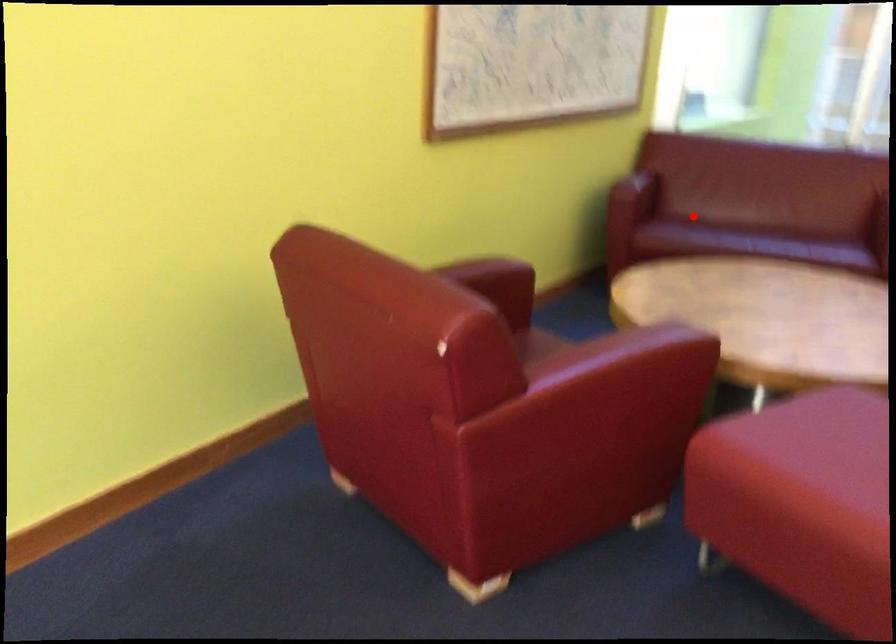
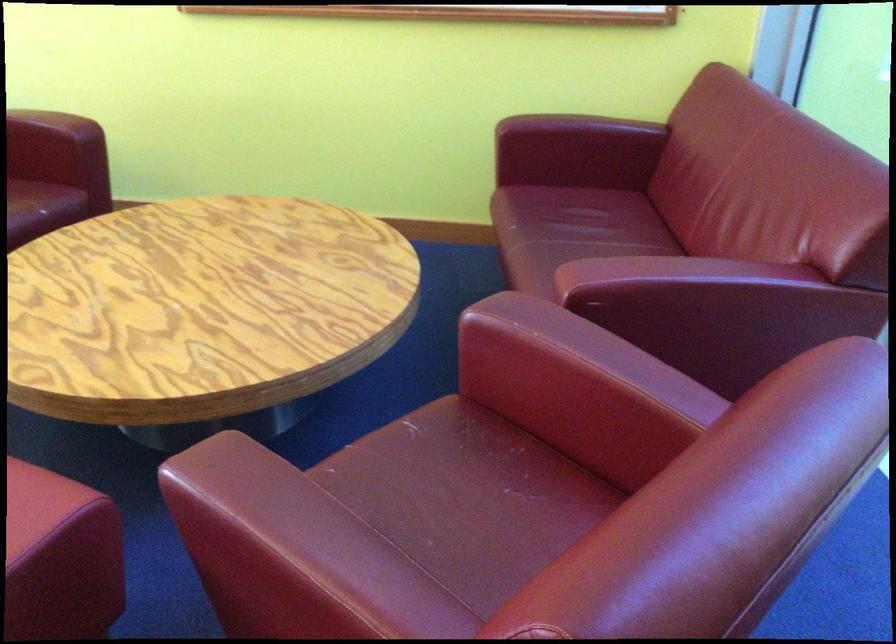
Question: I am providing you with two images of the same scene from different viewpoints. Given a red point in image1, look at the same physical point in image2. Is it:

Choices:
 (A) Closer to the viewpoint
 (B) Farther from the viewpoint

Answer: (A)